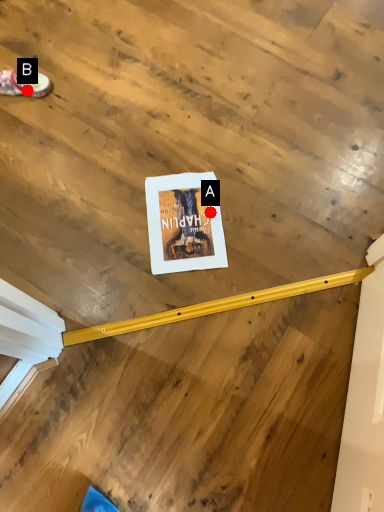
Question: Two points are circled on the image, labeled by A and B beside each circle. Among these points, which one is farthest from the camera?

Choices:
 (A) A is further
 (B) B is further

Answer: (B)